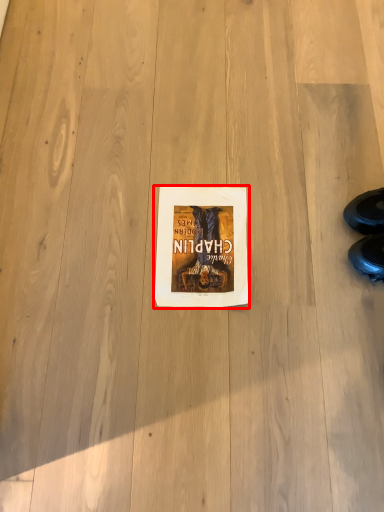
Question: From the image's perspective, where is paperback book (annotated by the red box) located relative to leather shoe?

Choices:
 (A) below
 (B) above

Answer: (B)